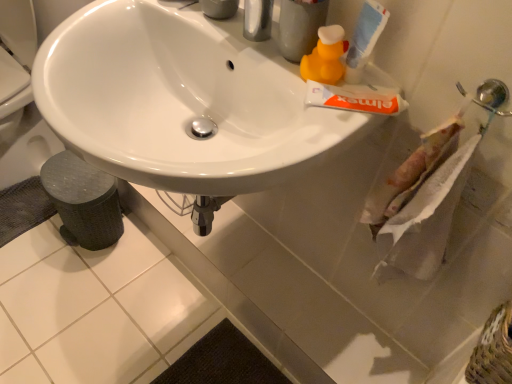
Describe the element at coordinates (23, 208) in the screenshot. I see `gray textured bath mat at lower left` at that location.

In order to face white glossy sink at center, should I rotate leftwards or rightwards?

You should rotate left by 9.324 degrees.

Measure the distance between point (389, 258) and camera.

The depth of point (389, 258) is 34.13 inches.

Locate an element on the screen. yellow rubber duck at upper right is located at coordinates (325, 56).

Between point (435, 236) and point (102, 120), which one is positioned behind?

Point (435, 236)

Is white paper towel at right facing towards white glossy sink at center?

No, white paper towel at right is not oriented towards white glossy sink at center.

Is white paper towel at right not close to white glossy sink at center?

That's not correct — white paper towel at right is a little close to white glossy sink at center.

From the picture: Which is nearer, (x=355, y=42) or (x=421, y=277)?

Point (x=355, y=42) is positioned closer to the camera compared to point (x=421, y=277).

From a real-world perspective, is white matte tube of toothpaste at upper right, acting as the 2th toothpaste starting from the bottom, physically above white paper towel at right?

Yes.

Which object is thinner, white matte tube of toothpaste at upper right, which is counted as the 1th toothpaste, starting from the top, or white paper towel at right?

With smaller width is white matte tube of toothpaste at upper right, which is counted as the 1th toothpaste, starting from the top.

What's the angular difference between white glossy sink at center and yellow rubber duck at upper right's facing directions?

The facing directions of white glossy sink at center and yellow rubber duck at upper right are 3.47 degrees apart.

Find the location of a particular element. sink in front of the yellow rubber duck at upper right is located at coordinates (183, 101).

Is there a large distance between white glossy sink at center and yellow rubber duck at upper right?

They are positioned close to each other.

In terms of size, does white glossy sink at center appear bigger or smaller than yellow rubber duck at upper right?

white glossy sink at center is bigger than yellow rubber duck at upper right.

From the image's perspective, between gray textured bath mat at lower left and white paper towel at right, which one is located above?

white paper towel at right, from the image's perspective.

In the image, is gray textured bath mat at lower left positioned in front of or behind white paper towel at right?

gray textured bath mat at lower left is positioned farther from the viewer than white paper towel at right.

In the scene shown: Which point is more distant from viewer, (9, 198) or (439, 239)?

The point (9, 198) is farther from the camera.

Could white paper towel at right be considered to be inside gray textured bath mat at lower left?

No, white paper towel at right is not inside gray textured bath mat at lower left.

Is white matte tube of toothpaste at upper right, which is counted as the first toothpaste, starting from the bottom, oriented towards white glossy sink at center?

No, white matte tube of toothpaste at upper right, which is counted as the first toothpaste, starting from the bottom, is not turned towards white glossy sink at center.

Would you say white matte tube of toothpaste at upper right, which is counted as the first toothpaste, starting from the bottom, is to the left or to the right of white glossy sink at center in the picture?

In the image, white matte tube of toothpaste at upper right, which is counted as the first toothpaste, starting from the bottom, appears on the right side of white glossy sink at center.

Locate an element on the screen. The height and width of the screenshot is (384, 512). toothpaste below the white glossy sink at center (from the image's perspective) is located at coordinates (356, 98).

Are white matte tube of toothpaste at upper right, marked as the second toothpaste in a top-to-bottom arrangement, and white glossy sink at center beside each other?

No, white matte tube of toothpaste at upper right, marked as the second toothpaste in a top-to-bottom arrangement, is not next to white glossy sink at center.

Consider the image. Is white matte tube of toothpaste at upper right, which is counted as the 1th toothpaste, starting from the top, facing away from yellow rubber duck at upper right?

white matte tube of toothpaste at upper right, which is counted as the 1th toothpaste, starting from the top, is not turned away from yellow rubber duck at upper right.

You are a GUI agent. You are given a task and a screenshot of the screen. Output one action in this format:
    pyautogui.click(x=<x>, y=<y>)
    Task: Click on the cleaning product below the white matte tube of toothpaste at upper right, acting as the 2th toothpaste starting from the bottom (from the image's perspective)
    The width and height of the screenshot is (512, 384).
    Given the screenshot: What is the action you would take?
    pyautogui.click(x=325, y=56)

Consider the image. Do you think white matte tube of toothpaste at upper right, acting as the 2th toothpaste starting from the bottom, is within yellow rubber duck at upper right, or outside of it?

white matte tube of toothpaste at upper right, acting as the 2th toothpaste starting from the bottom, cannot be found inside yellow rubber duck at upper right.

Which of these two, white matte tube of toothpaste at upper right, acting as the 2th toothpaste starting from the bottom, or yellow rubber duck at upper right, is smaller?

With smaller size is yellow rubber duck at upper right.

From the image's perspective, is white matte tube of toothpaste at upper right, marked as the second toothpaste in a top-to-bottom arrangement, over yellow rubber duck at upper right?

No, from the image's perspective, white matte tube of toothpaste at upper right, marked as the second toothpaste in a top-to-bottom arrangement, is not above yellow rubber duck at upper right.

Considering the sizes of objects white matte tube of toothpaste at upper right, which is counted as the first toothpaste, starting from the bottom, and yellow rubber duck at upper right in the image provided, who is bigger, white matte tube of toothpaste at upper right, which is counted as the first toothpaste, starting from the bottom, or yellow rubber duck at upper right?

white matte tube of toothpaste at upper right, which is counted as the first toothpaste, starting from the bottom, is bigger.

Does white matte tube of toothpaste at upper right, marked as the second toothpaste in a top-to-bottom arrangement, appear on the right side of yellow rubber duck at upper right?

Yes.

At what (x,y) coordinates should I click in order to perform the action: click on toilet paper on the right of white glossy sink at center. Please return your answer as a coordinate pair (x, y). This screenshot has width=512, height=384. Looking at the image, I should click on (424, 221).

Locate an element on the screen. This screenshot has width=512, height=384. toilet paper located in front of the white matte tube of toothpaste at upper right, acting as the 2th toothpaste starting from the bottom is located at coordinates (x=424, y=221).

Considering their positions, is gray textured bath mat at lower left positioned closer to white paper towel at right than yellow rubber duck at upper right?

The object closer to white paper towel at right is yellow rubber duck at upper right.

Looking at this image, looking at the image, which one is located closer to gray textured bath mat at lower left, white matte tube of toothpaste at upper right, acting as the 2th toothpaste starting from the bottom, or textured woven basket at lower right?

The object closer to gray textured bath mat at lower left is white matte tube of toothpaste at upper right, acting as the 2th toothpaste starting from the bottom.

Based on their spatial positions, is white paper towel at right or textured woven basket at lower right closer to gray textured bath mat at lower left?

The object closer to gray textured bath mat at lower left is white paper towel at right.

When comparing their distances from white matte tube of toothpaste at upper right, which is counted as the first toothpaste, starting from the bottom, does white matte tube of toothpaste at upper right, acting as the 2th toothpaste starting from the bottom, or yellow rubber duck at upper right seem further?

white matte tube of toothpaste at upper right, acting as the 2th toothpaste starting from the bottom, lies further to white matte tube of toothpaste at upper right, which is counted as the first toothpaste, starting from the bottom, than the other object.

From the image, which object appears to be farther from white glossy sink at center, textured woven basket at lower right or white matte tube of toothpaste at upper right, acting as the 2th toothpaste starting from the bottom?

textured woven basket at lower right.

When comparing their distances from white paper towel at right, does white matte tube of toothpaste at upper right, acting as the 2th toothpaste starting from the bottom, or white matte tube of toothpaste at upper right, marked as the second toothpaste in a top-to-bottom arrangement, seem closer?

white matte tube of toothpaste at upper right, marked as the second toothpaste in a top-to-bottom arrangement, lies closer to white paper towel at right than the other object.

From the image, which object appears to be farther from textured woven basket at lower right, white glossy sink at center or white paper towel at right?

white glossy sink at center is positioned further to the anchor textured woven basket at lower right.

Looking at the image, which one is located closer to yellow rubber duck at upper right, white paper towel at right or gray textured bath mat at lower left?

white paper towel at right.

Find the location of a particular element. The width and height of the screenshot is (512, 384). cleaning product between gray textured bath mat at lower left and white paper towel at right is located at coordinates (325, 56).

Locate an element on the screen. toothpaste between white glossy sink at center and white matte tube of toothpaste at upper right, which is counted as the 1th toothpaste, starting from the top, from left to right is located at coordinates (356, 98).

Identify the location of toothpaste between white matte tube of toothpaste at upper right, acting as the 2th toothpaste starting from the bottom, and textured woven basket at lower right, in the vertical direction. The width and height of the screenshot is (512, 384). (356, 98).

Where is `sink located between gray textured bath mat at lower left and textured woven basket at lower right in the left-right direction`? sink located between gray textured bath mat at lower left and textured woven basket at lower right in the left-right direction is located at coordinates (183, 101).